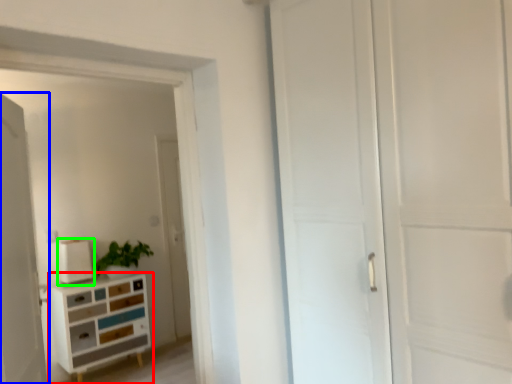
Question: Which is farther away from chest of drawers (highlighted by a red box)? door (highlighted by a blue box) or appliance (highlighted by a green box)?

Choices:
 (A) door
 (B) appliance

Answer: (A)